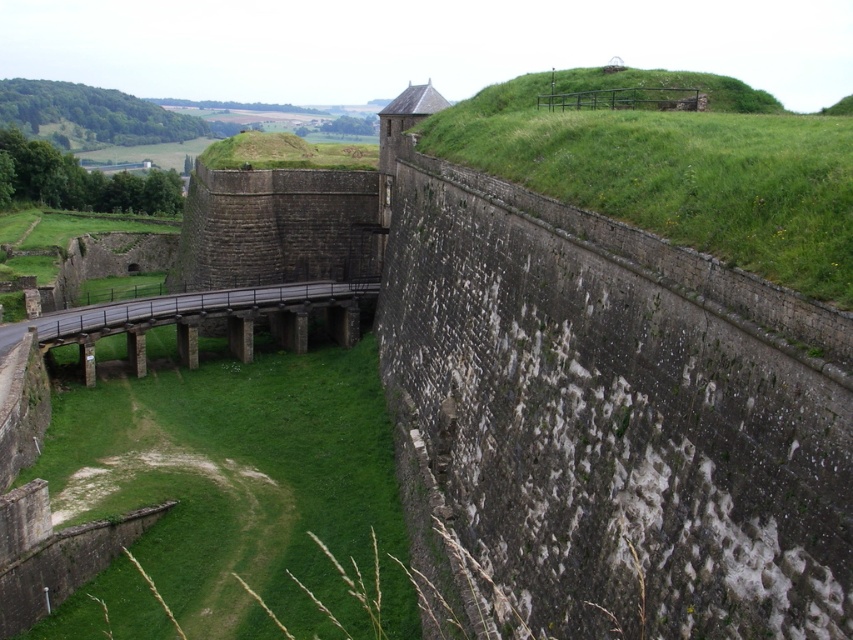
Can you confirm if green grassy at lower left is thinner than green grassy hill at upper right?

Indeed, green grassy at lower left has a lesser width compared to green grassy hill at upper right.

Which of these two, green grassy at lower left or green grassy hill at upper right, stands shorter?

With less height is green grassy at lower left.

Does point (189, 532) come farther from viewer compared to point (724, 156)?

Yes, point (189, 532) is behind point (724, 156).

The height and width of the screenshot is (640, 853). Identify the location of green grassy at lower left. (244, 483).

Does green grassy at lower left appear on the right side of brown stone bridge at center?

Correct, you'll find green grassy at lower left to the right of brown stone bridge at center.

Between green grassy at lower left and brown stone bridge at center, which one appears on the left side from the viewer's perspective?

brown stone bridge at center is more to the left.

Who is more distant from viewer, (154, 634) or (338, 284)?

The point (338, 284) is behind.

Where is `green grassy at lower left`? The height and width of the screenshot is (640, 853). green grassy at lower left is located at coordinates (244, 483).

Who is more forward, (526, 168) or (212, 307)?

Positioned in front is point (526, 168).

Is green grassy hill at upper right to the left of brown stone bridge at center from the viewer's perspective?

In fact, green grassy hill at upper right is to the right of brown stone bridge at center.

Which is behind, point (766, 214) or point (143, 349)?

Positioned behind is point (143, 349).

Where is `green grassy hill at upper right`? green grassy hill at upper right is located at coordinates (676, 168).